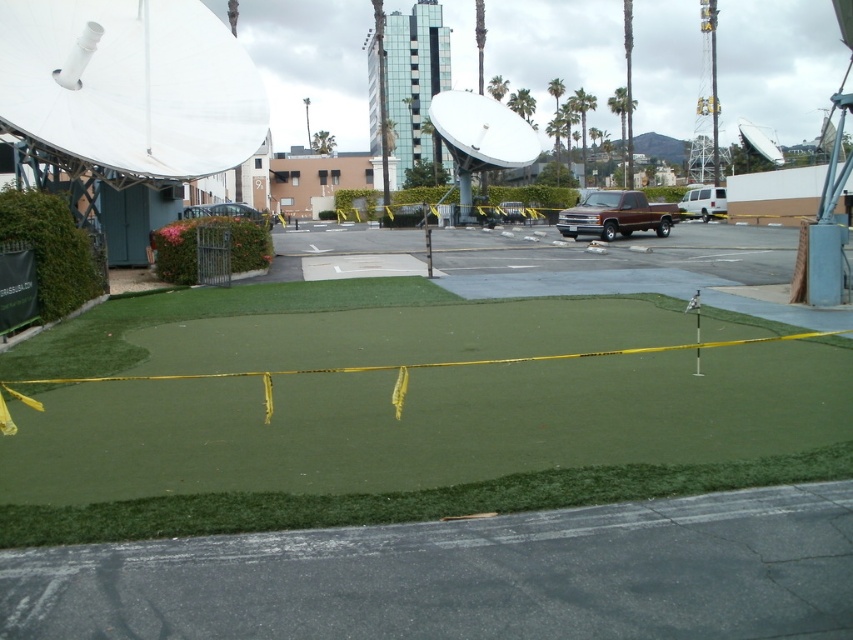
You are standing at the yellow caution tape on the artificial turf and want to walk to the parking lot. There are two points marked as point 1 at coordinates (489, 170) and point 2 at coordinates (625, 195). Which point should you avoid stepping on if you want to stay on the path leading to the parking lot?

You should avoid stepping on point 2 at coordinates (625, 195) because point 1 at coordinates (489, 170) is behind it, so the path to the parking lot likely goes around point 2.

You are standing at the point marked by the coordinates point (227,211) in the image. Looking around, you see the metallic silver car at center. What object is located at your current position?

The point (227,211) corresponds to the metallic silver car at center.